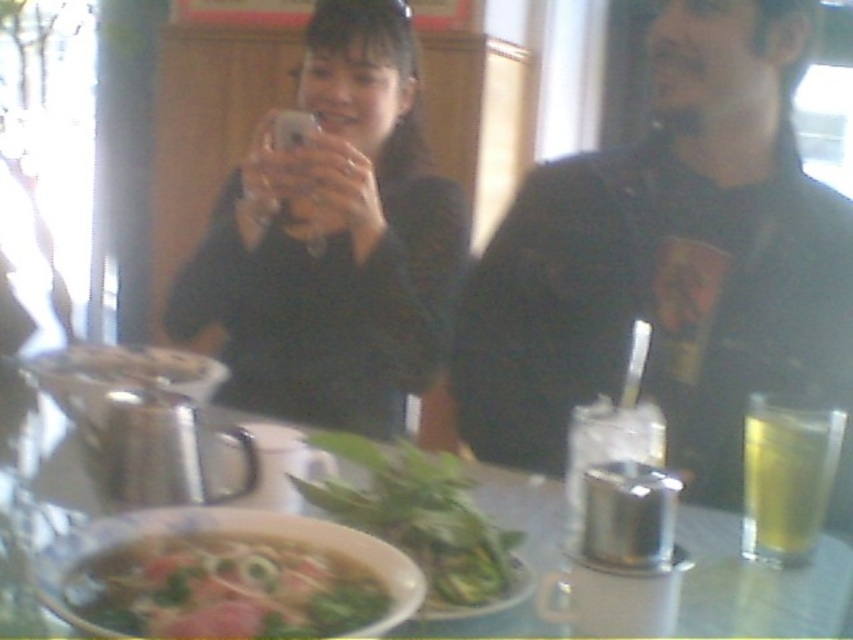
What are the coordinates of the metallic silver cup at right?

The metallic silver cup at right is located at coordinates point (669, 260).

You are a waiter in a restaurant and need to serve two items to a customer. The customer asks you to bring the larger item first. Which item should you bring first between the metallic bowl at center and the yellow translucent glass at right?

The metallic bowl at center is larger than the yellow translucent glass at right, so you should bring the metallic bowl at center first.